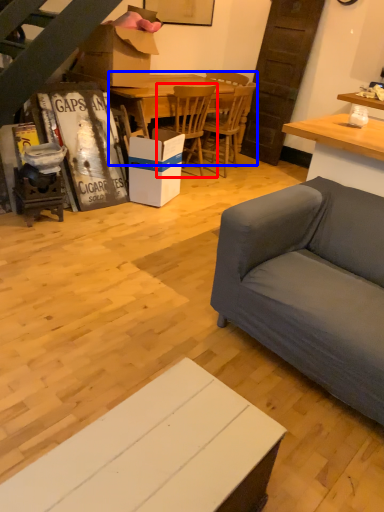
Question: Among these objects, which one is nearest to the camera, chair (highlighted by a red box) or kitchen & dining room table (highlighted by a blue box)?

Choices:
 (A) chair
 (B) kitchen & dining room table

Answer: (B)